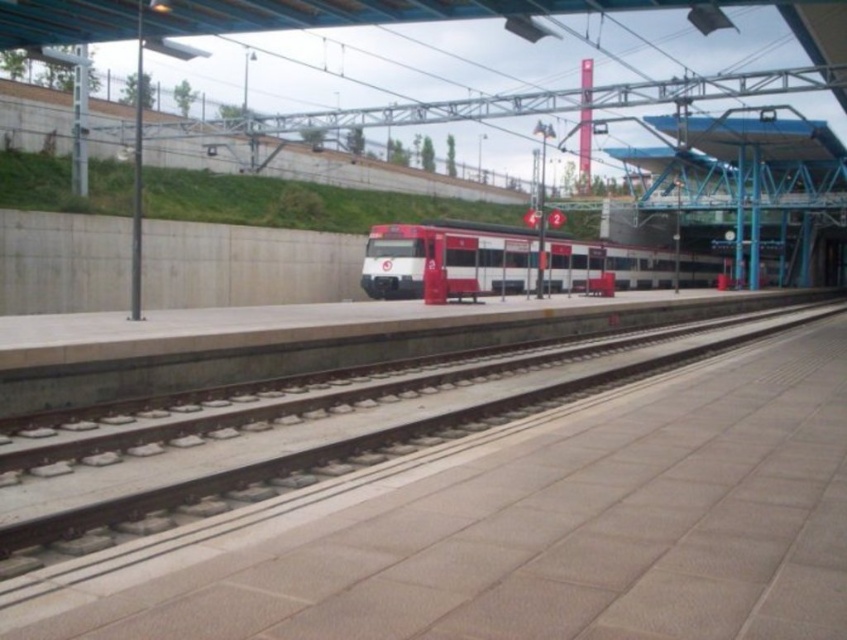
You are a maintenance worker needing to place a 1.5 meter wide equipment on the platform. The equipment must be placed between the smooth concrete track at center and the white glossy train at center. Can the equipment fit there?

The smooth concrete track at center is thinner than the white glossy train at center, so the space between them might be sufficient for the 1.5 meter wide equipment. However, without exact measurements, it is uncertain. The description only states the track is thinner, but not by how much.

You are standing on the platform at the train station. You need to walk to the smooth concrete track at center. Which direction should you walk to reach it?

The smooth concrete track at center is located at point [329,458], so you should walk towards the center of the platform to reach it.

In the scene shown: You are standing on the platform at the train station. There is a point marked at coordinates (329, 458). What object is located at that point?

The point at coordinates (329, 458) indicates the smooth concrete track at center.